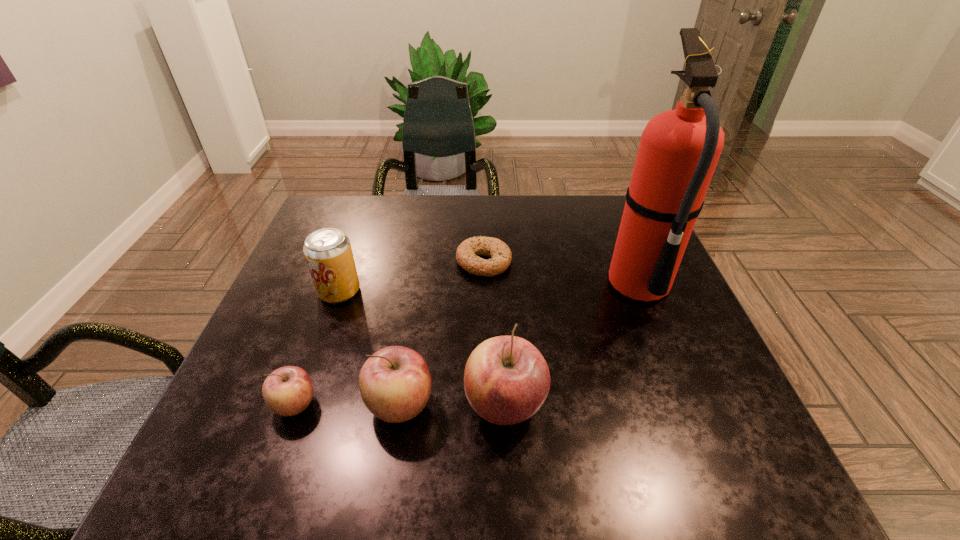
Identify the location of object positioned at the near left corner. This screenshot has height=540, width=960. (287, 391).

The width and height of the screenshot is (960, 540). Identify the location of free spot at the far edge of the desktop. (374, 240).

Image resolution: width=960 pixels, height=540 pixels. Identify the location of vacant space at the near edge of the desktop. (551, 412).

At what (x,y) coordinates should I click in order to perform the action: click on vacant space at the left edge. Please return your answer as a coordinate pair (x, y). The width and height of the screenshot is (960, 540). Looking at the image, I should click on (314, 292).

The width and height of the screenshot is (960, 540). In the image, there is a desktop. What are the coordinates of `vacant space at the right edge` in the screenshot? It's located at (680, 364).

At what (x,y) coordinates should I click in order to perform the action: click on vacant space at the far left corner of the desktop. Please return your answer as a coordinate pair (x, y). The height and width of the screenshot is (540, 960). Looking at the image, I should click on (330, 206).

I want to click on vacant area at the near right corner, so click(x=705, y=400).

The width and height of the screenshot is (960, 540). What are the coordinates of `free space between the pop (soda) and the rightmost apple` in the screenshot? It's located at (422, 348).

This screenshot has width=960, height=540. I want to click on unoccupied area between the shortest object and the fourth object from right to left, so click(x=442, y=333).

Where is `vacant area that lies between the shortest apple and the fire extinguisher`? This screenshot has width=960, height=540. vacant area that lies between the shortest apple and the fire extinguisher is located at coordinates (x=467, y=345).